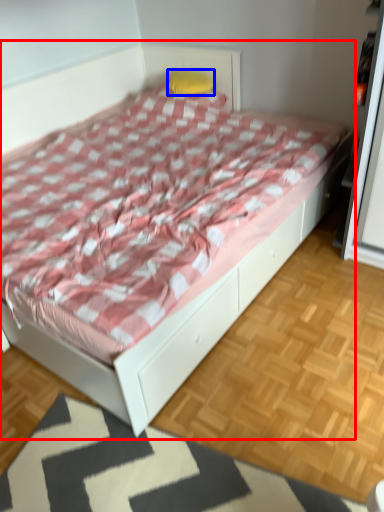
Question: Which object appears closest to the camera in this image, bed (highlighted by a red box) or pillow (highlighted by a blue box)?

Choices:
 (A) bed
 (B) pillow

Answer: (A)